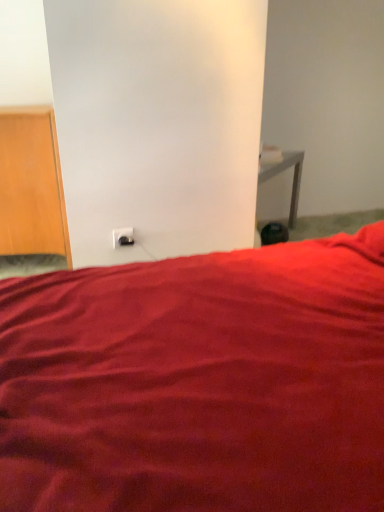
Question: Is wooden door at left turned away from white plastic electric outlet at lower center?

Choices:
 (A) no
 (B) yes

Answer: (A)

Question: From the image's perspective, is wooden door at left above white plastic electric outlet at lower center?

Choices:
 (A) no
 (B) yes

Answer: (B)

Question: Can white plastic electric outlet at lower center be found inside wooden door at left?

Choices:
 (A) no
 (B) yes

Answer: (A)

Question: Does wooden door at left have a greater height compared to white plastic electric outlet at lower center?

Choices:
 (A) no
 (B) yes

Answer: (B)

Question: Can you confirm if wooden door at left is smaller than white plastic electric outlet at lower center?

Choices:
 (A) no
 (B) yes

Answer: (A)

Question: Does wooden door at left appear on the right side of white plastic electric outlet at lower center?

Choices:
 (A) no
 (B) yes

Answer: (A)

Question: Considering the relative positions of wooden door at left and matte red bed at center in the image provided, is wooden door at left in front of matte red bed at center?

Choices:
 (A) no
 (B) yes

Answer: (A)

Question: From a real-world perspective, is wooden door at left beneath matte red bed at center?

Choices:
 (A) yes
 (B) no

Answer: (B)

Question: Is wooden door at left shorter than matte red bed at center?

Choices:
 (A) no
 (B) yes

Answer: (A)

Question: From a real-world perspective, is wooden door at left over matte red bed at center?

Choices:
 (A) yes
 (B) no

Answer: (A)

Question: Is wooden door at left thinner than matte red bed at center?

Choices:
 (A) yes
 (B) no

Answer: (A)

Question: Does wooden door at left lie behind matte red bed at center?

Choices:
 (A) no
 (B) yes

Answer: (B)

Question: Does white plastic electric outlet at lower center contain matte red bed at center?

Choices:
 (A) yes
 (B) no

Answer: (B)